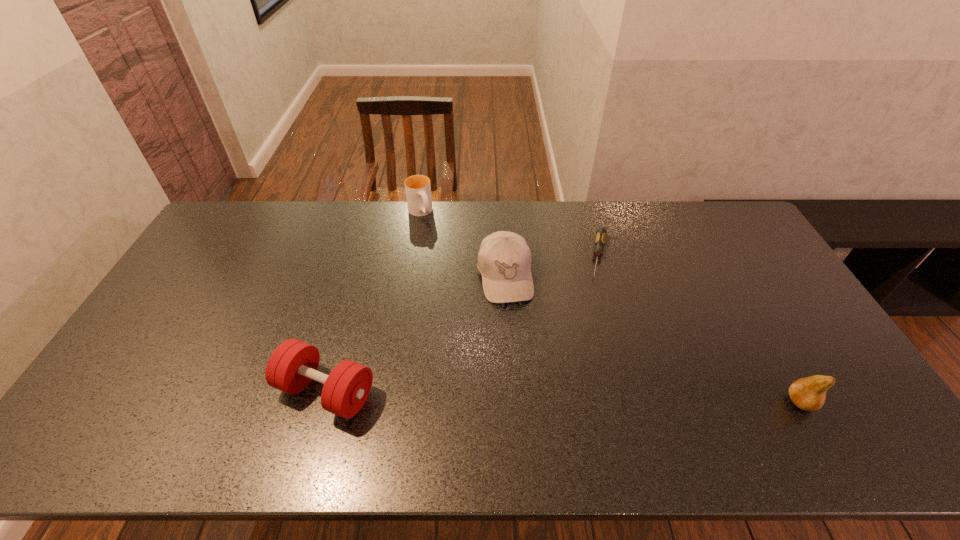
The width and height of the screenshot is (960, 540). What are the coordinates of `free region located on the front-facing side of the third object from left to right` in the screenshot? It's located at (513, 325).

The image size is (960, 540). What are the coordinates of `free space located with the handle on the side of the cup` in the screenshot? It's located at (443, 252).

Where is `free space located with the handle on the side of the cup`? free space located with the handle on the side of the cup is located at coordinates (449, 262).

The height and width of the screenshot is (540, 960). What are the coordinates of `free region located with the handle on the side of the cup` in the screenshot? It's located at (464, 286).

Where is `free point located insert the shortest object into a screw head`? The height and width of the screenshot is (540, 960). free point located insert the shortest object into a screw head is located at coordinates (587, 382).

At what (x,y) coordinates should I click in order to perform the action: click on blank space located 0.200m insert the shortest object into a screw head. Please return your answer as a coordinate pair (x, y). The width and height of the screenshot is (960, 540). Looking at the image, I should click on (595, 327).

The image size is (960, 540). I want to click on vacant point located 0.140m insert the shortest object into a screw head, so click(x=597, y=312).

Find the location of a particular element. The width and height of the screenshot is (960, 540). cup that is at the far edge is located at coordinates (418, 189).

Locate an element on the screen. This screenshot has height=540, width=960. screwdriver present at the far edge is located at coordinates (600, 239).

In order to click on dumbbell that is at the near edge in this screenshot , I will do `click(293, 364)`.